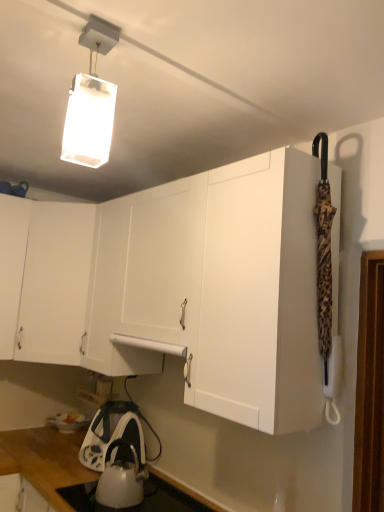
Question: Is white glossy kettle at lower center to the left or to the right of white glossy kettle at lower center in the image?

Choices:
 (A) left
 (B) right

Answer: (B)

Question: Looking at the image, does white glossy kettle at lower center seem bigger or smaller compared to white glossy kettle at lower center?

Choices:
 (A) big
 (B) small

Answer: (B)

Question: Which is nearer to the white matte cabinet at upper left?

Choices:
 (A) white glossy kettle at lower center
 (B) white matte rectangular light fixture at upper center
 (C) white glossy kettle at lower center

Answer: (C)

Question: Considering the real-world distances, which object is farthest from the white glossy kettle at lower center?

Choices:
 (A) white matte rectangular light fixture at upper center
 (B) white glossy kettle at lower center
 (C) white matte cabinet at upper left

Answer: (A)